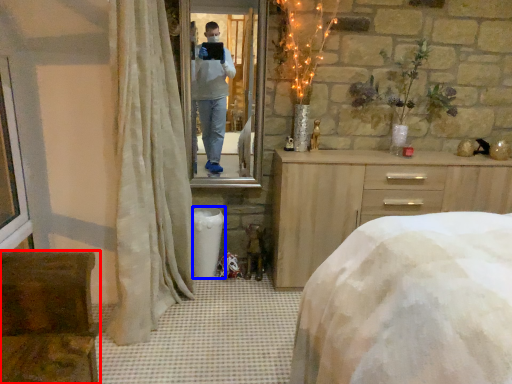
Question: Which point is further to the camera, furniture (highlighted by a red box) or trash bin/can (highlighted by a blue box)?

Choices:
 (A) furniture
 (B) trash bin/can

Answer: (B)